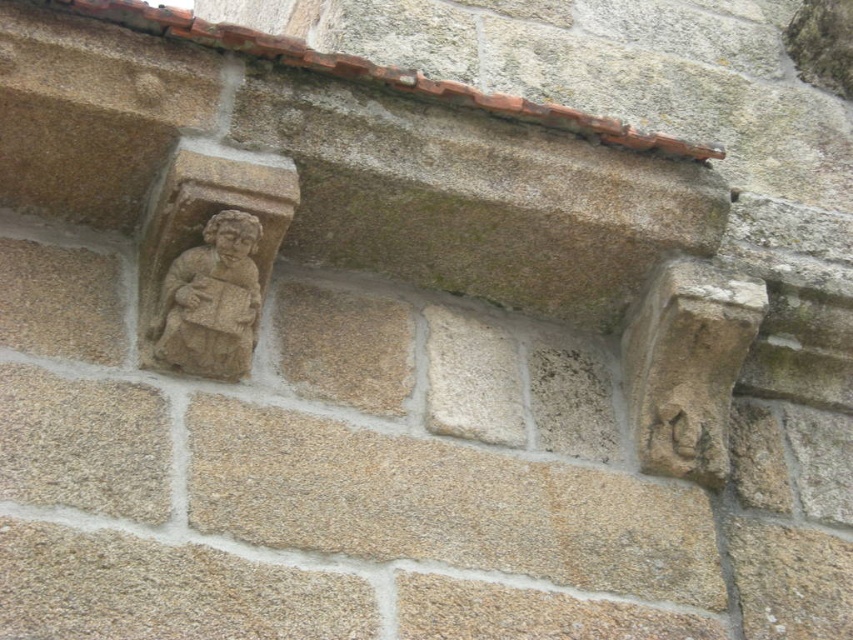
You are an architect examining the stone wall and notice two elements at the upper left corner. The beige stone figure at upper left and the carved stone face at upper left. Which one is positioned more to the left?

The beige stone figure at upper left is positioned to the left of the carved stone face at upper left, so it is more to the left.

You are an architect standing 15 meters away from a stone wall. You notice the beige stone figure at upper left. Can you reach it without moving closer?

The beige stone figure at upper left is 16.99 meters away from the viewer. Since you are currently 15 meters away, you are already closer than the figure, so you can reach it without moving closer.